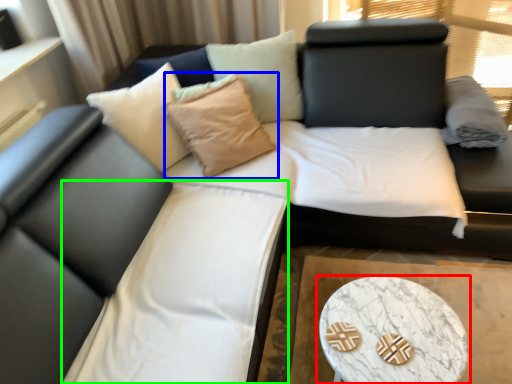
Question: Which object is the farthest from coffee table (highlighted by a red box)? Choose among these: throw pillow (highlighted by a blue box) or bedding (highlighted by a green box).

Choices:
 (A) throw pillow
 (B) bedding

Answer: (A)